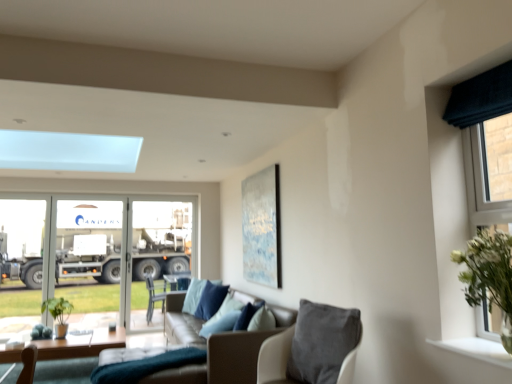
The width and height of the screenshot is (512, 384). Find the location of `wooden table at lower left`. wooden table at lower left is located at coordinates (80, 345).

Locate an element on the screen. transparent glass screen door at center is located at coordinates (157, 253).

What do you see at coordinates (215, 348) in the screenshot? I see `leather couch at center` at bounding box center [215, 348].

What is the approximate width of matte gray picture frame at upper center?

The width of matte gray picture frame at upper center is 6.92 centimeters.

The width and height of the screenshot is (512, 384). Find the location of `leather couch at center`. leather couch at center is located at coordinates (181, 323).

Measure the distance between leather couch at center and camera.

leather couch at center is 12.39 feet from camera.

You are a GUI agent. You are given a task and a screenshot of the screen. Output one action in this format:
    pyautogui.click(x=<x>, y=<y>)
    Task: Click on the white smooth window sill at lower right
    The width and height of the screenshot is (512, 384).
    Given the screenshot: What is the action you would take?
    pyautogui.click(x=477, y=350)

Is metallic silver trailer truck at left bigger or smaller than leather couch at center?

Clearly, metallic silver trailer truck at left is smaller in size than leather couch at center.

Is metallic silver trailer truck at left not close to leather couch at center?

Yes, metallic silver trailer truck at left and leather couch at center are located far from each other.

Is metallic silver trailer truck at left inside or outside of leather couch at center?

metallic silver trailer truck at left cannot be found inside leather couch at center.

Is the depth of white smooth window sill at lower right greater than that of suede-like beige chair at lower center?

That is False.

Is white smooth window sill at lower right aimed at suede-like beige chair at lower center?

No, white smooth window sill at lower right is not aimed at suede-like beige chair at lower center.

Locate an element on the screen. This screenshot has height=384, width=512. chair on the left of white smooth window sill at lower right is located at coordinates (313, 347).

From a real-world perspective, who is located lower, white smooth window sill at lower right or suede-like beige chair at lower center?

From a 3D spatial view, suede-like beige chair at lower center is below.

Could you tell me if white smooth window sill at lower right is turned towards dark blue fabric curtain at right?

No, white smooth window sill at lower right does not turn towards dark blue fabric curtain at right.

Relative to dark blue fabric curtain at right, is white smooth window sill at lower right in front or behind?

Visually, white smooth window sill at lower right is located in front of dark blue fabric curtain at right.

Is white smooth window sill at lower right touching dark blue fabric curtain at right?

white smooth window sill at lower right and dark blue fabric curtain at right are clearly separated.

Does point (505, 351) lie behind point (499, 176)?

No, it is in front of (499, 176).

Considering the sizes of transparent glass screen door at center and white smooth window sill at lower right in the image, is transparent glass screen door at center wider or thinner than white smooth window sill at lower right?

In the image, transparent glass screen door at center appears to be more narrow than white smooth window sill at lower right.

From a real-world perspective, is transparent glass screen door at center positioned above or below white smooth window sill at lower right?

transparent glass screen door at center is above white smooth window sill at lower right.

Considering the points (139, 313) and (469, 342), which point is behind, point (139, 313) or point (469, 342)?

Positioned behind is point (139, 313).

Which point is more forward, (257, 194) or (502, 157)?

The point (502, 157) is closer.

Which is correct: matte gray picture frame at upper center is inside dark blue fabric curtain at right, or outside of it?

Result: matte gray picture frame at upper center is located beyond the bounds of dark blue fabric curtain at right.

Is matte gray picture frame at upper center thinner than dark blue fabric curtain at right?

Yes, matte gray picture frame at upper center is thinner than dark blue fabric curtain at right.

Is matte gray picture frame at upper center in front of or behind dark blue fabric curtain at right in the image?

matte gray picture frame at upper center is behind dark blue fabric curtain at right.

Which is correct: dark blue fabric curtain at right is inside metallic silver trailer truck at left, or outside of it?

The correct answer is: outside.

Looking at this image, measure the distance from dark blue fabric curtain at right to metallic silver trailer truck at left.

dark blue fabric curtain at right is 17.32 feet away from metallic silver trailer truck at left.

Who is smaller, dark blue fabric curtain at right or metallic silver trailer truck at left?

dark blue fabric curtain at right.

Are dark blue fabric curtain at right and metallic silver trailer truck at left far apart?

Yes, dark blue fabric curtain at right and metallic silver trailer truck at left are located far from each other.

You are a GUI agent. You are given a task and a screenshot of the screen. Output one action in this format:
    pyautogui.click(x=<x>, y=<y>)
    Task: Click on the trailer truck on the left of matte gray picture frame at upper center
    
    Given the screenshot: What is the action you would take?
    click(89, 240)

Is metallic silver trailer truck at left located within matte gray picture frame at upper center?

No, matte gray picture frame at upper center does not contain metallic silver trailer truck at left.

Considering the sizes of objects matte gray picture frame at upper center and metallic silver trailer truck at left in the image provided, who is thinner, matte gray picture frame at upper center or metallic silver trailer truck at left?

With smaller width is matte gray picture frame at upper center.

Based on their sizes in the image, would you say matte gray picture frame at upper center is bigger or smaller than metallic silver trailer truck at left?

Clearly, matte gray picture frame at upper center is smaller in size than metallic silver trailer truck at left.

The height and width of the screenshot is (384, 512). Find the location of `couch in front of the metallic silver trailer truck at left`. couch in front of the metallic silver trailer truck at left is located at coordinates (181, 323).

This screenshot has width=512, height=384. In order to click on window sill on the right of suede-like beige chair at lower center in this screenshot , I will do `click(477, 350)`.

From the image, which object appears to be farther from white smooth window sill at lower right, matte gray picture frame at upper center or velvet blue pillow at center?

matte gray picture frame at upper center lies further to white smooth window sill at lower right than the other object.

Estimate the real-world distances between objects in this image. Which object is further from transparent glass screen door at center, leather couch at center or velvet blue pillow at center?

velvet blue pillow at center lies further to transparent glass screen door at center than the other object.

Considering their positions, is leather couch at center positioned further to dark blue fabric curtain at right than velvet blue pillow at center?

The object further to dark blue fabric curtain at right is velvet blue pillow at center.

Looking at the image, which one is located further to wooden table at lower left, white smooth window sill at lower right or dark blue fabric curtain at right?

dark blue fabric curtain at right is positioned further to the anchor wooden table at lower left.

Estimate the real-world distances between objects in this image. Which object is further from transparent glass screen door at center, metallic silver trailer truck at left or matte gray picture frame at upper center?

The object further to transparent glass screen door at center is matte gray picture frame at upper center.

From the picture: Estimate the real-world distances between objects in this image. Which object is further from metallic silver trailer truck at left, velvet blue pillow at center or dark blue fabric curtain at right?

dark blue fabric curtain at right.

Which object lies nearer to the anchor point wooden table at lower left, velvet blue pillow at center or transparent glass screen door at center?

The object closer to wooden table at lower left is velvet blue pillow at center.

Which object lies further to the anchor point matte gray picture frame at upper center, dark blue fabric curtain at right or suede-like beige chair at lower center?

dark blue fabric curtain at right lies further to matte gray picture frame at upper center than the other object.

Locate an element on the screen. This screenshot has width=512, height=384. couch between wooden table at lower left and velvet blue pillow at center is located at coordinates (181, 323).

The image size is (512, 384). I want to click on picture frame positioned between suede-like beige chair at lower center and velvet blue pillow at center from near to far, so click(x=261, y=227).

You are a GUI agent. You are given a task and a screenshot of the screen. Output one action in this format:
    pyautogui.click(x=<x>, y=<y>)
    Task: Click on the trailer truck between white smooth window sill at lower right and transparent glass screen door at center from front to back
    Image resolution: width=512 pixels, height=384 pixels.
    Given the screenshot: What is the action you would take?
    pyautogui.click(x=89, y=240)

Locate an element on the screen. This screenshot has width=512, height=384. table located between white smooth window sill at lower right and metallic silver trailer truck at left in the depth direction is located at coordinates (80, 345).